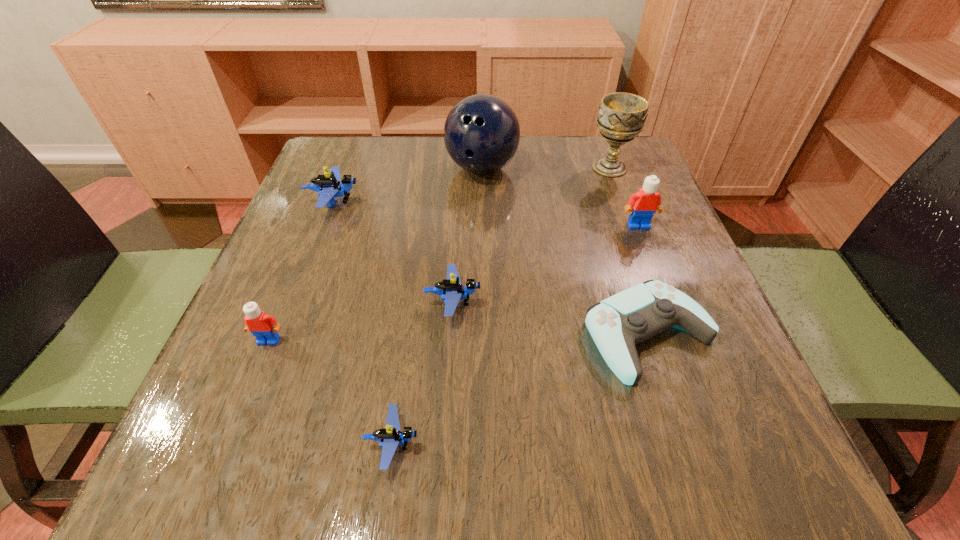
This screenshot has height=540, width=960. I want to click on blue bowling ball, so click(x=481, y=134).

The image size is (960, 540). I want to click on white chalice, so click(622, 116).

At what (x,y) coordinates should I click in order to perform the action: click on the bigger white Lego. Please return your answer as a coordinate pair (x, y). Looking at the image, I should click on (647, 200).

In order to click on the rightmost Lego in this screenshot , I will do `click(647, 200)`.

The height and width of the screenshot is (540, 960). Identify the location of the biggest blue Lego. (329, 186).

Identify the location of the farthest blue Lego. This screenshot has width=960, height=540. (329, 186).

This screenshot has width=960, height=540. Find the location of `the second nearest Lego`. the second nearest Lego is located at coordinates (262, 326).

Where is `the nearer white Lego`? the nearer white Lego is located at coordinates tap(262, 326).

Image resolution: width=960 pixels, height=540 pixels. In order to click on the second nearest blue Lego in this screenshot , I will do `click(451, 290)`.

This screenshot has height=540, width=960. Find the location of `the second smallest blue Lego`. the second smallest blue Lego is located at coordinates (451, 290).